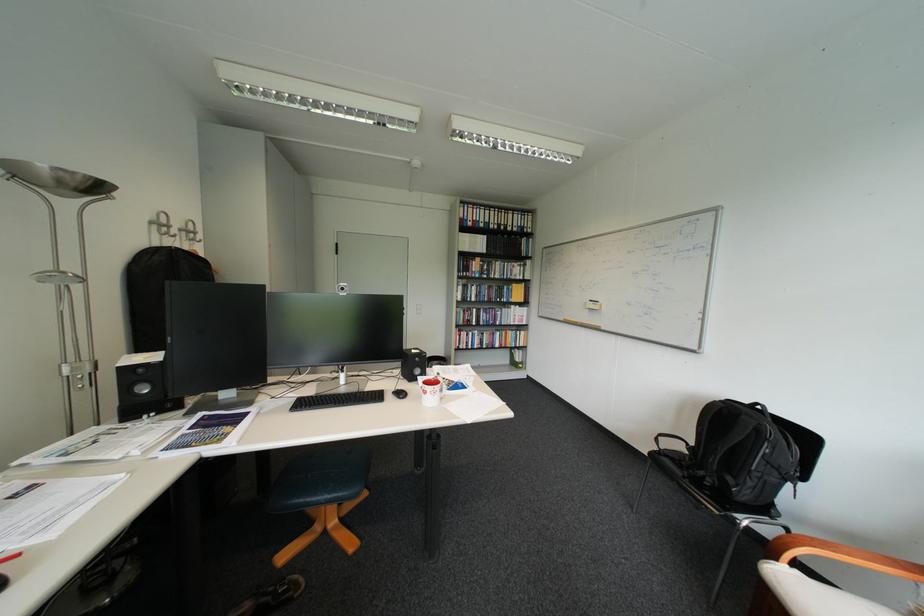
Image resolution: width=924 pixels, height=616 pixels. Find the location of `black hanging backpack`. black hanging backpack is located at coordinates (156, 290).